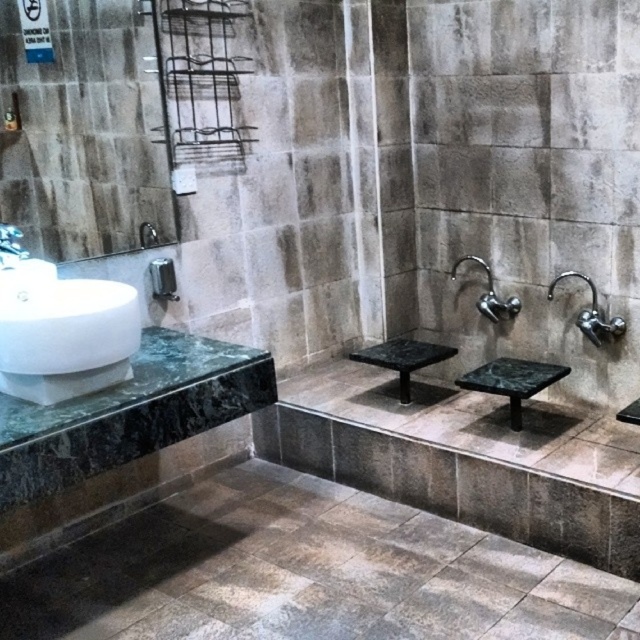
Who is more distant from viewer, (48, 404) or (6, 248)?

Positioned behind is point (6, 248).

Does point (118, 346) come closer to viewer compared to point (4, 257)?

Yes.

What do you see at coordinates (68, 339) in the screenshot? I see `white marble sink at left` at bounding box center [68, 339].

The width and height of the screenshot is (640, 640). What are the coordinates of `white marble sink at left` in the screenshot? It's located at (68, 339).

Can you confirm if black marble stool at center is bigger than polished chrome faucet at upper center?

Correct, black marble stool at center is larger in size than polished chrome faucet at upper center.

Does black marble stool at center appear on the right side of polished chrome faucet at upper center?

No, black marble stool at center is not to the right of polished chrome faucet at upper center.

Is point (355, 356) positioned before point (484, 308)?

Yes.

The image size is (640, 640). I want to click on black marble stool at center, so click(x=403, y=358).

Where is `green marble counter top at left`? Image resolution: width=640 pixels, height=640 pixels. green marble counter top at left is located at coordinates (128, 384).

The image size is (640, 640). Describe the element at coordinates (128, 384) in the screenshot. I see `green marble counter top at left` at that location.

You are a GUI agent. You are given a task and a screenshot of the screen. Output one action in this format:
    pyautogui.click(x=<x>, y=<y>)
    Task: Click on the green marble counter top at left
    The width and height of the screenshot is (640, 640).
    Given the screenshot: What is the action you would take?
    pyautogui.click(x=128, y=384)

In order to click on green marble counter top at left in this screenshot , I will do `click(128, 384)`.